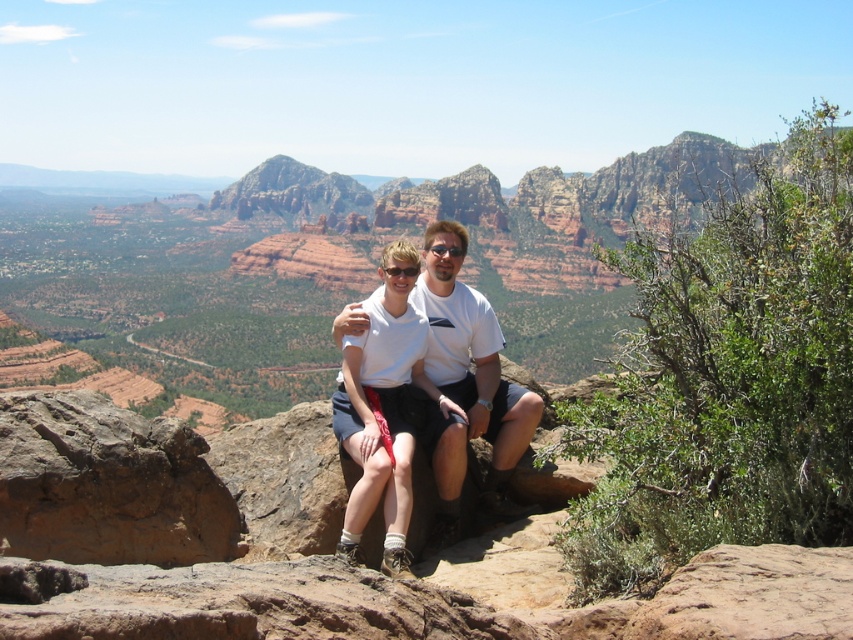
Question: Among these points, which one is nearest to the camera?

Choices:
 (A) (86, 529)
 (B) (468, 308)

Answer: (A)

Question: Which point is farther to the camera?

Choices:
 (A) white cotton shirt at center
 (B) brown rough rock at lower left

Answer: (A)

Question: Does brown rough rock at lower left appear on the right side of white cotton shirt at center?

Choices:
 (A) no
 (B) yes

Answer: (A)

Question: Where is brown rough rock at lower left located in relation to white cotton shirt at center in the image?

Choices:
 (A) above
 (B) below

Answer: (B)

Question: Which object appears closest to the camera in this image?

Choices:
 (A) brown rough rock at lower left
 (B) white cotton shirt at center

Answer: (A)

Question: Considering the relative positions of brown rough rock at lower left and white cotton shirt at center in the image provided, where is brown rough rock at lower left located with respect to white cotton shirt at center?

Choices:
 (A) left
 (B) right

Answer: (A)